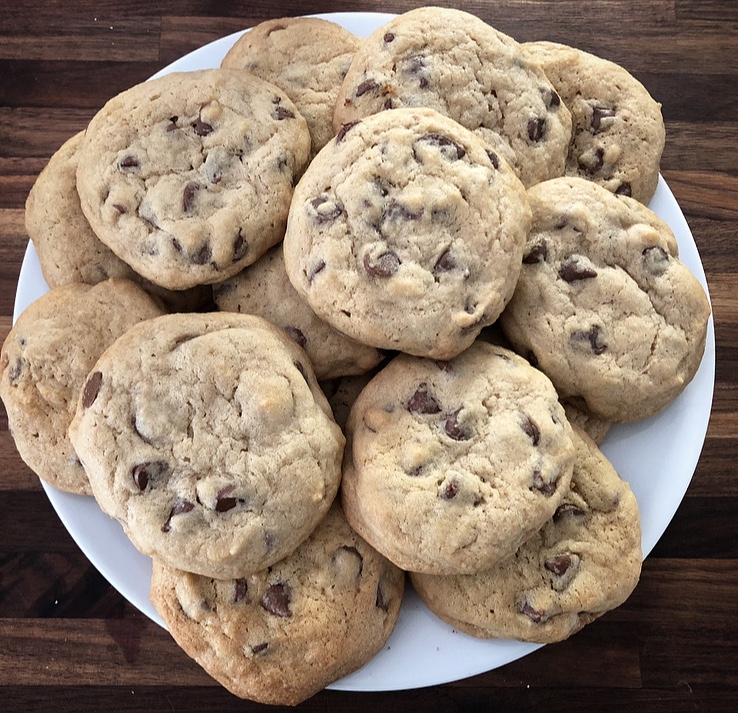
Find the location of a particular element. This screenshot has width=738, height=713. plate is located at coordinates (438, 656).